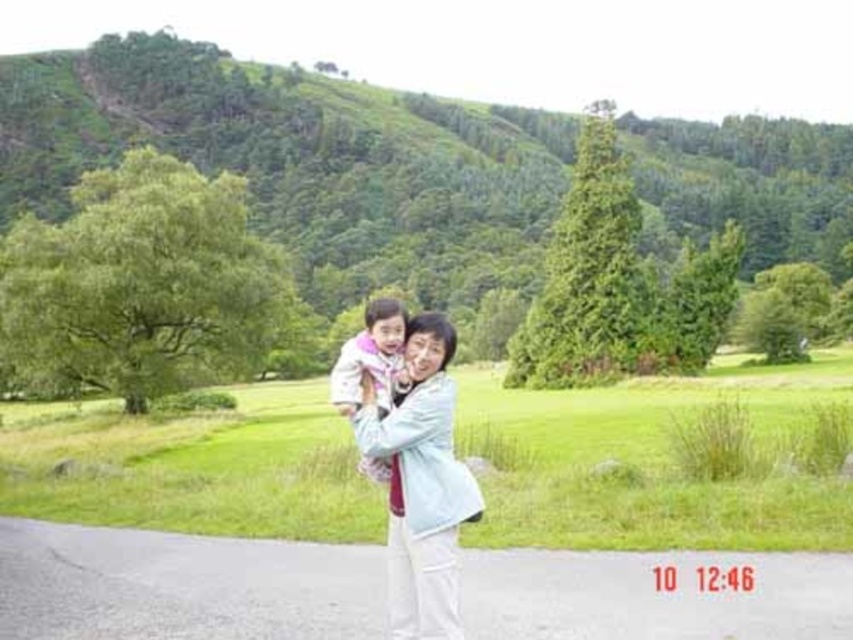
Question: Based on their relative distances, which object is farther from the pink fabric at center?

Choices:
 (A) green grass at center
 (B) light blue fabric at center

Answer: (A)

Question: Can you confirm if light blue fabric at center is positioned to the left of pink fabric at center?

Choices:
 (A) no
 (B) yes

Answer: (A)

Question: Which point appears closest to the camera in this image?

Choices:
 (A) (401, 333)
 (B) (387, 452)
 (C) (471, 422)

Answer: (B)

Question: Which point is closer to the camera taking this photo?

Choices:
 (A) (368, 364)
 (B) (424, 376)

Answer: (B)

Question: Is green grass at center positioned behind light blue fabric at center?

Choices:
 (A) yes
 (B) no

Answer: (A)

Question: Is green grass at center to the right of light blue fabric at center from the viewer's perspective?

Choices:
 (A) no
 (B) yes

Answer: (A)